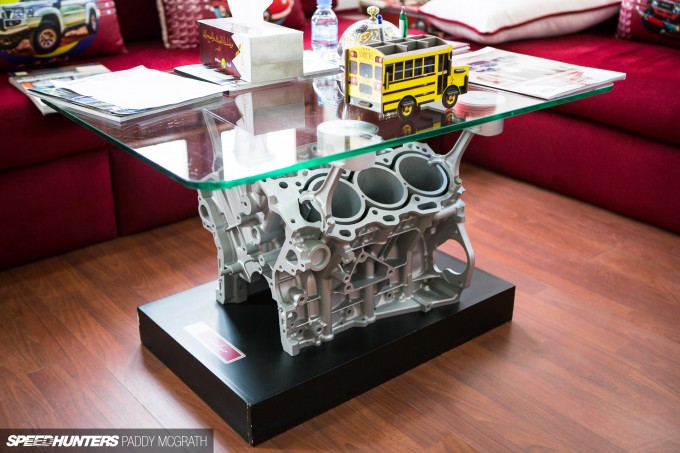
This screenshot has width=680, height=453. I want to click on sofa, so click(x=668, y=150).